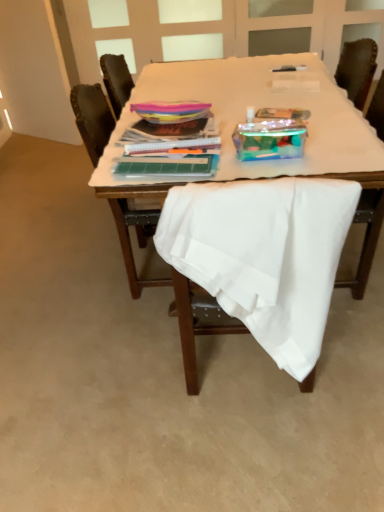
Find the location of `blank space situated above white fabric-covered table at center (from a real-world perspective)`. blank space situated above white fabric-covered table at center (from a real-world perspective) is located at coordinates (278, 90).